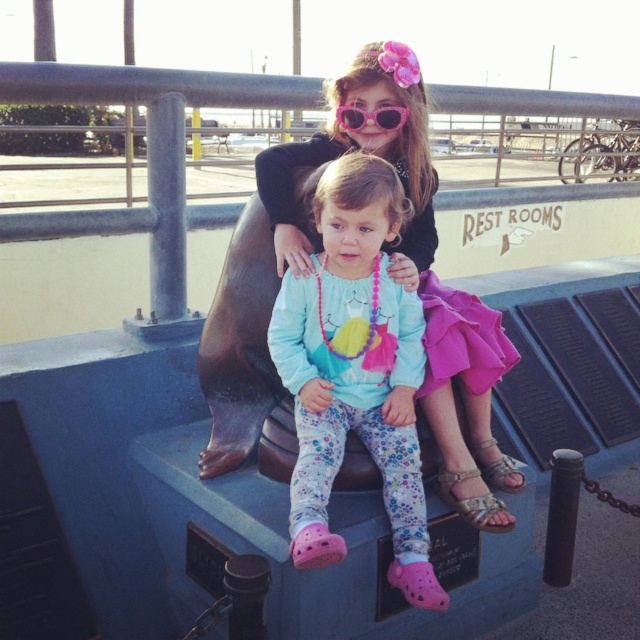
Question: Does matte black dress at center appear over pink plastic sunglasses at upper center?

Choices:
 (A) no
 (B) yes

Answer: (A)

Question: Observing the image, what is the correct spatial positioning of fluffy cotton pants at center in reference to pink plastic sunglasses at upper center?

Choices:
 (A) above
 (B) below

Answer: (B)

Question: Which object is positioned farthest from the pink plastic sunglasses at upper center?

Choices:
 (A) fluffy cotton pants at center
 (B) matte black dress at center

Answer: (A)

Question: Can you confirm if matte black dress at center is wider than pink plastic sunglasses at upper center?

Choices:
 (A) no
 (B) yes

Answer: (B)

Question: Which object appears farthest from the camera in this image?

Choices:
 (A) matte black dress at center
 (B) fluffy cotton pants at center

Answer: (A)

Question: Which object appears closest to the camera in this image?

Choices:
 (A) fluffy cotton pants at center
 (B) matte black dress at center

Answer: (A)